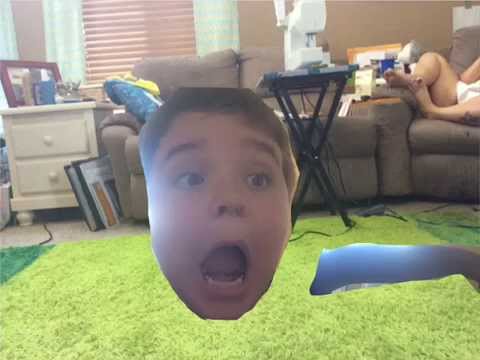
What are the coordinates of `couch` in the screenshot? It's located at (351, 137).